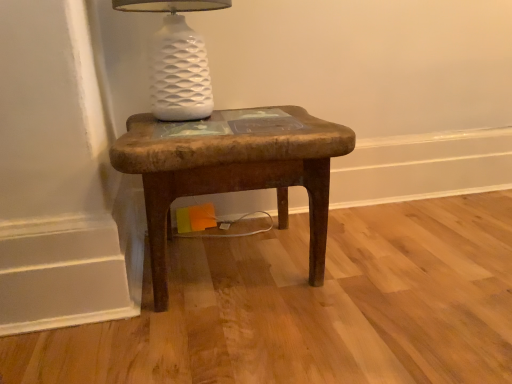
Where is `blank area beneath white ceramic lamp at upper center (from a real-world perspective)`? The width and height of the screenshot is (512, 384). blank area beneath white ceramic lamp at upper center (from a real-world perspective) is located at coordinates (190, 121).